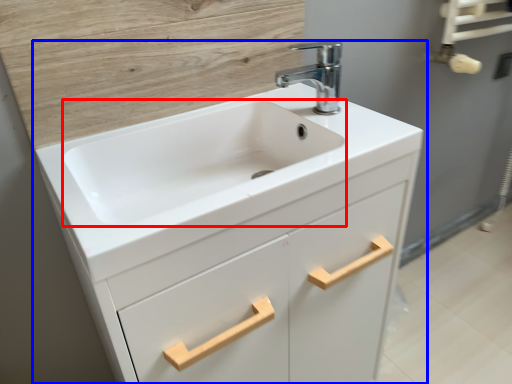
Question: Which of the following is the closest to the observer, sink (highlighted by a red box) or bathroom cabinet (highlighted by a blue box)?

Choices:
 (A) sink
 (B) bathroom cabinet

Answer: (B)